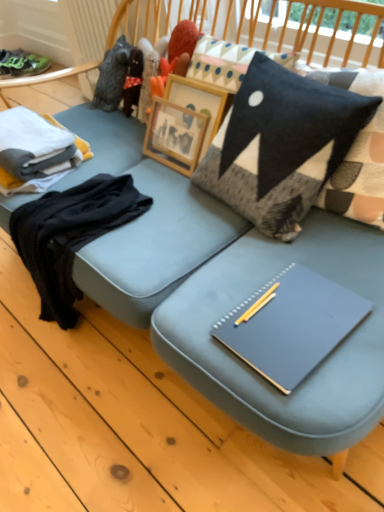
Question: Is matte gray notebook at center aimed at black cotton sweater at left, which is the 2th clothing from top to bottom?

Choices:
 (A) no
 (B) yes

Answer: (A)

Question: Is matte gray notebook at center positioned in front of black cotton sweater at left, which is the 2th clothing from top to bottom?

Choices:
 (A) yes
 (B) no

Answer: (A)

Question: From a real-world perspective, is matte gray notebook at center under black cotton sweater at left, which is the 2th clothing from top to bottom?

Choices:
 (A) no
 (B) yes

Answer: (A)

Question: Is matte gray notebook at center next to black cotton sweater at left, which is the 2th clothing from top to bottom, and touching it?

Choices:
 (A) no
 (B) yes

Answer: (A)

Question: Is the depth of matte gray notebook at center greater than that of black cotton sweater at left, the first clothing positioned from the bottom?

Choices:
 (A) no
 (B) yes

Answer: (A)

Question: In terms of height, does black felt pillow at upper right look taller or shorter compared to matte gray notebook at center?

Choices:
 (A) tall
 (B) short

Answer: (A)

Question: From the image's perspective, relative to matte gray notebook at center, is black felt pillow at upper right above or below?

Choices:
 (A) below
 (B) above

Answer: (B)

Question: Considering their positions, is black felt pillow at upper right located in front of or behind matte gray notebook at center?

Choices:
 (A) behind
 (B) front

Answer: (B)

Question: From a real-world perspective, is black felt pillow at upper right physically located above or below matte gray notebook at center?

Choices:
 (A) above
 (B) below

Answer: (A)

Question: Considering their positions, is matte gray notebook at center located in front of or behind green suede sneakers at upper left?

Choices:
 (A) behind
 (B) front

Answer: (B)

Question: From the image's perspective, is matte gray notebook at center above or below green suede sneakers at upper left?

Choices:
 (A) below
 (B) above

Answer: (A)

Question: Looking at the image, does matte gray notebook at center seem bigger or smaller compared to green suede sneakers at upper left?

Choices:
 (A) small
 (B) big

Answer: (A)

Question: Is point (292, 387) closer or farther from the camera than point (23, 55)?

Choices:
 (A) closer
 (B) farther

Answer: (A)

Question: From the image's perspective, is black felt pillow at upper right above or below white cotton folded clothes at left, which ranks as the 1th clothing in top-to-bottom order?

Choices:
 (A) below
 (B) above

Answer: (A)

Question: Based on their positions, is black felt pillow at upper right located to the left or right of white cotton folded clothes at left, which ranks as the 1th clothing in top-to-bottom order?

Choices:
 (A) left
 (B) right

Answer: (B)